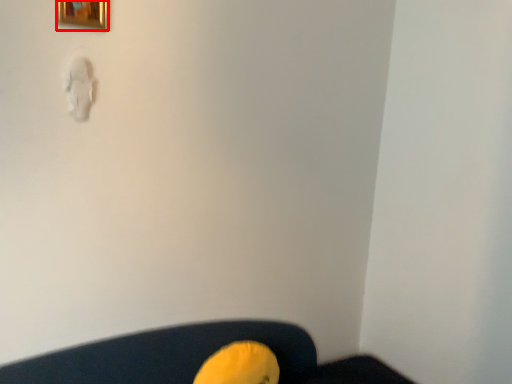
Question: From the image's perspective, where is picture frame (annotated by the red box) located relative to bean bag chair?

Choices:
 (A) below
 (B) above

Answer: (B)